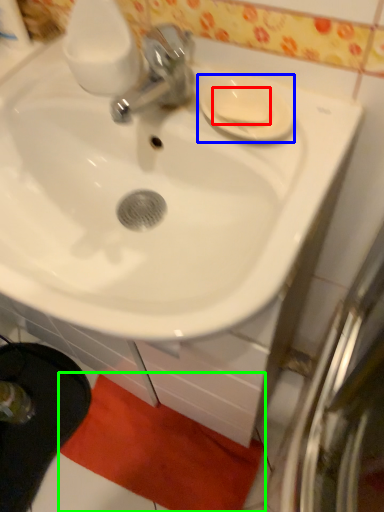
Question: Considering the real-world distances, which object is farthest from soap (highlighted by a red box)? saucer (highlighted by a blue box) or bath mat (highlighted by a green box)?

Choices:
 (A) saucer
 (B) bath mat

Answer: (B)